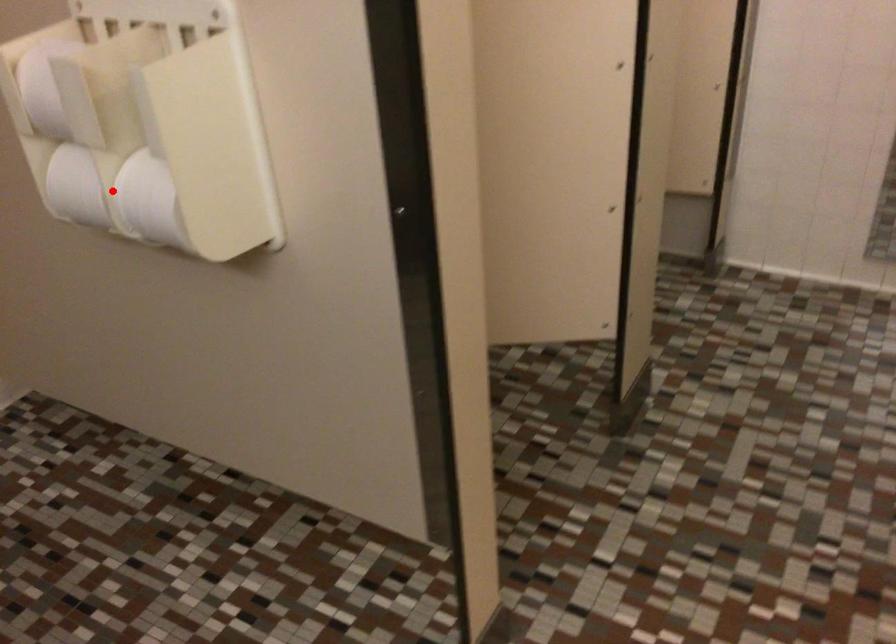
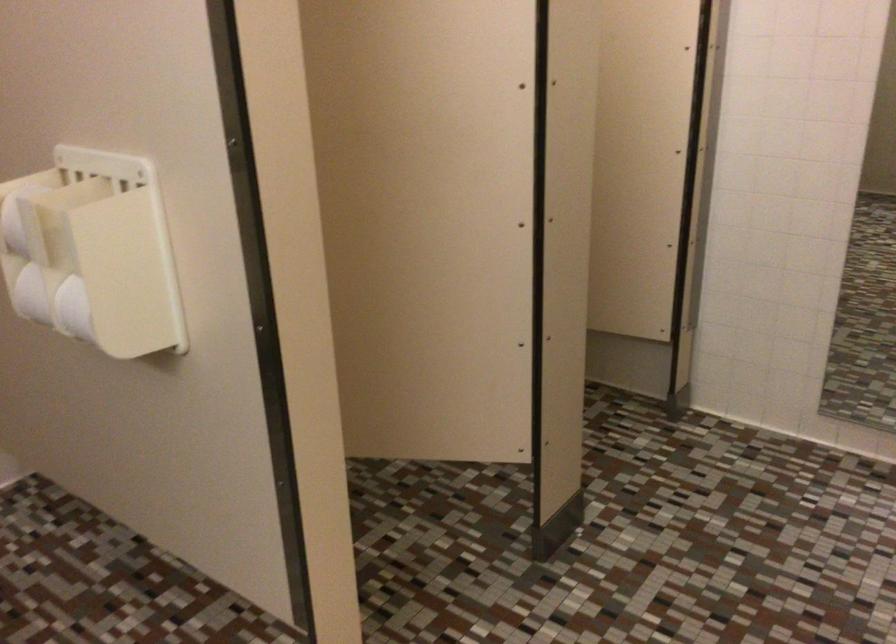
Question: I am providing you with two images of the same scene from different viewpoints. In image1, a red point is highlighted. Considering the same 3D point in image2, which of the following is correct?

Choices:
 (A) It is closer
 (B) It is farther

Answer: (B)